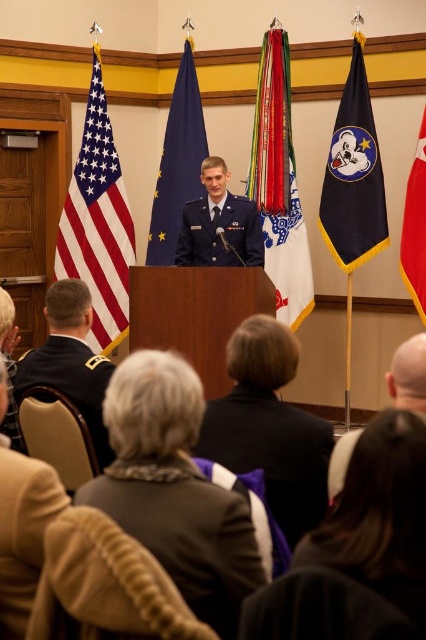
You are an event planner ensuring proper seating arrangements. You notice two uniforms at the center of the podium area. Which one is taller, the dark blue uniform at center or the dark blue fabric uniform at center?

The dark blue uniform at center is much taller as dark blue fabric uniform at center.

You are a photographer standing at the back of the room. You want to take a photo of the dark blue uniform at center so that both the uniform and the flags behind them are clearly visible. Given that your camera has a maximum focus range of 3 meters, will you be able to capture both subjects in focus?

The dark blue uniform at center is 3.42 meters away. Since the camera can only focus up to 3 meters, the subject is slightly out of range. You might need to adjust your position or use a different camera setting to ensure both the uniform and the flags are in focus.